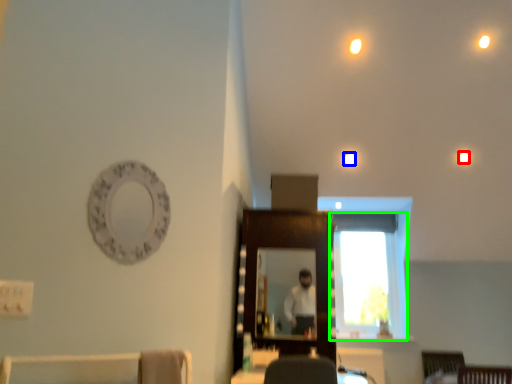
Question: Estimate the real-world distances between objects in this image. Which object is farther from lighting (highlighted by a red box), light (highlighted by a blue box) or window (highlighted by a green box)?

Choices:
 (A) light
 (B) window

Answer: (B)